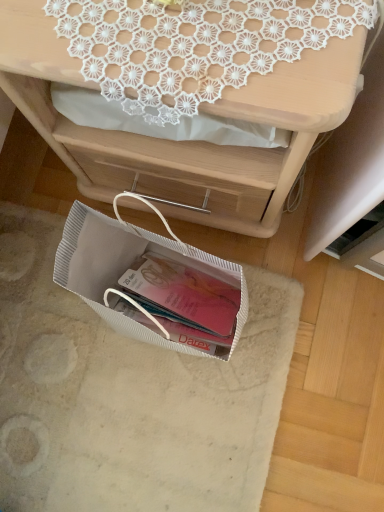
Question: Considering their positions, is white textured bag at lower center located in front of or behind matte white desk at upper center?

Choices:
 (A) behind
 (B) front

Answer: (A)

Question: Is white textured bag at lower center taller or shorter than matte white desk at upper center?

Choices:
 (A) short
 (B) tall

Answer: (A)

Question: Which object is positioned closest to the white textured bag at lower center?

Choices:
 (A) white lace doily at upper center
 (B) matte white desk at upper center

Answer: (B)

Question: Estimate the real-world distances between objects in this image. Which object is farther from the white textured bag at lower center?

Choices:
 (A) white lace doily at upper center
 (B) matte white desk at upper center

Answer: (A)